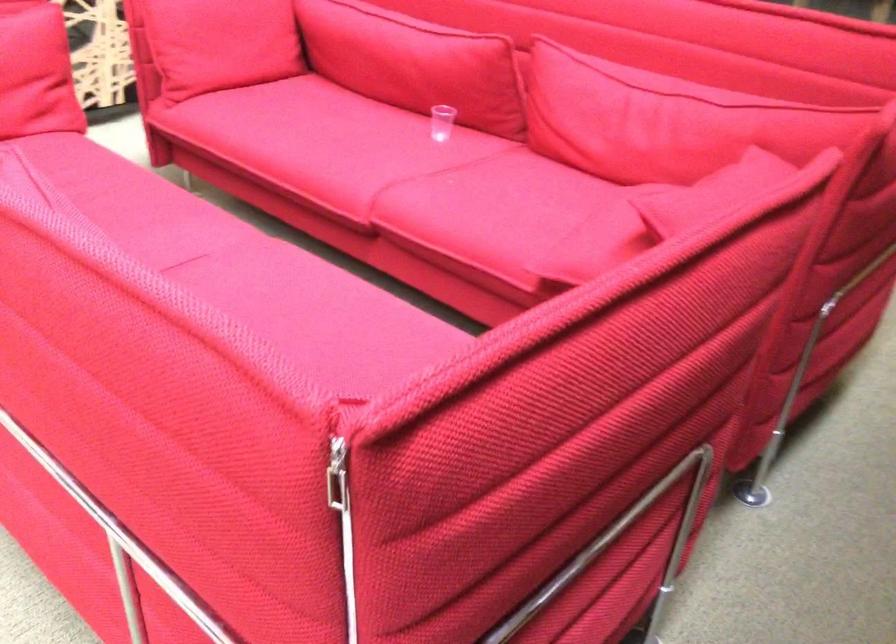
Which object does [442,122] point to?

It corresponds to the small clear cup in the image.